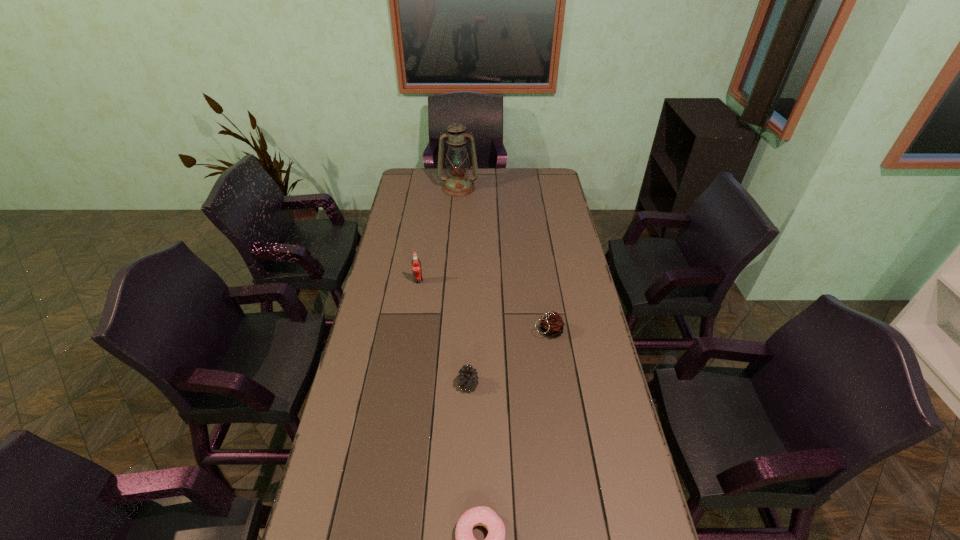
The height and width of the screenshot is (540, 960). I want to click on unoccupied position between the rightmost object and the second nearest object, so click(508, 358).

Identify the location of vacant area between the fourth shortest object and the farthest object. (439, 235).

You are a GUI agent. You are given a task and a screenshot of the screen. Output one action in this format:
    pyautogui.click(x=<x>, y=<y>)
    Task: Click on the free space between the oil lamp and the second farthest object
    Image resolution: width=960 pixels, height=540 pixels.
    Given the screenshot: What is the action you would take?
    pyautogui.click(x=439, y=235)

I want to click on free area in between the oil lamp and the soda bottle, so click(x=439, y=235).

At what (x,y) coordinates should I click in order to perform the action: click on vacant area that lies between the tallest object and the nearer pinecone. Please return your answer as a coordinate pair (x, y). Image resolution: width=960 pixels, height=540 pixels. Looking at the image, I should click on (463, 287).

Identify the location of blank region between the tallest object and the nearer pinecone. (463, 287).

Locate an element on the screen. The height and width of the screenshot is (540, 960). free point between the tallest object and the right pinecone is located at coordinates click(503, 260).

Where is `blank region between the oil lamp and the fourth nearest object`? blank region between the oil lamp and the fourth nearest object is located at coordinates (439, 235).

Locate an element on the screen. The height and width of the screenshot is (540, 960). empty location between the tallest object and the rightmost object is located at coordinates (503, 260).

Find the location of `free area in between the soda bottle and the nearer pinecone`. free area in between the soda bottle and the nearer pinecone is located at coordinates (444, 333).